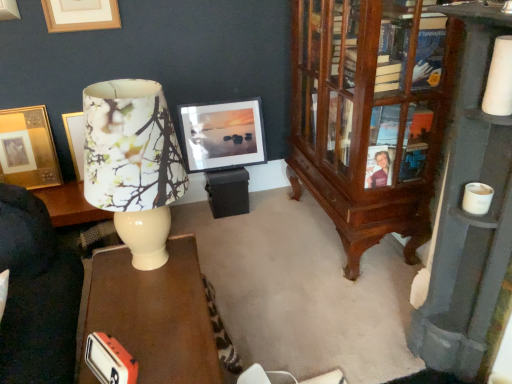
Question: In terms of width, does white glossy desk at lower left look wider or thinner when compared to wooden bookcase at right?

Choices:
 (A) wide
 (B) thin

Answer: (A)

Question: In the image, is white glossy desk at lower left positioned in front of or behind wooden bookcase at right?

Choices:
 (A) front
 (B) behind

Answer: (B)

Question: Based on their relative distances, which object is nearer to the wooden bookcase at right?

Choices:
 (A) floral paper lampshade at left
 (B) wooden cabinet at right
 (C) matte black picture frame at center, positioned as the 3th picture frame in left-to-right order
 (D) gold/golden/metallic picture frame at upper left, which is the third picture frame from right to left
 (E) wooden picture frame at upper left, placed as the 2th picture frame when sorted from right to left

Answer: (B)

Question: Estimate the real-world distances between objects in this image. Which object is farther from the wooden cabinet at right?

Choices:
 (A) white glossy desk at lower left
 (B) matte black picture frame at center, positioned as the 3th picture frame in left-to-right order
 (C) gold/golden/metallic picture frame at upper left, arranged as the 1th picture frame when viewed from the left
 (D) wooden picture frame at upper left, positioned as the 2th picture frame in left-to-right order
 (E) floral paper lampshade at left

Answer: (C)